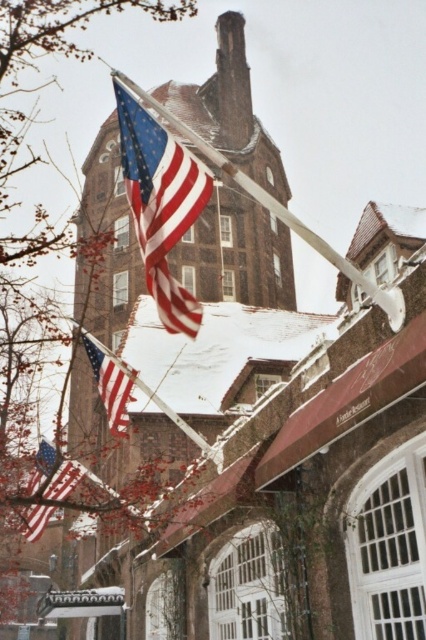
The width and height of the screenshot is (426, 640). What do you see at coordinates (63, 481) in the screenshot?
I see `matte red flag at lower left` at bounding box center [63, 481].

Between matte red flag at lower left and matte red flag at center, which one appears on the left side from the viewer's perspective?

matte red flag at lower left

In the scene shown: Who is more forward, (37, 481) or (118, 410)?

Point (118, 410) is in front.

What are the coordinates of `matte red flag at lower left` in the screenshot? It's located at (63, 481).

What do you see at coordinates (279, 211) in the screenshot? I see `metallic flag pole at upper center` at bounding box center [279, 211].

Is point (249, 188) closer to camera compared to point (77, 467)?

Yes, point (249, 188) is in front of point (77, 467).

Where is `metallic flag pole at upper center`? metallic flag pole at upper center is located at coordinates pyautogui.click(x=279, y=211).

Where is `metallic flag pole at upper center`? metallic flag pole at upper center is located at coordinates (279, 211).

Which is behind, point (195, 211) or point (114, 378)?

The point (114, 378) is more distant.

Is point (143, 113) farther from viewer compared to point (92, 342)?

No, it is in front of (92, 342).

Does point (189, 330) lie behind point (92, 344)?

No, it is not.

Image resolution: width=426 pixels, height=640 pixels. I want to click on matte red flag at upper center, so click(x=161, y=204).